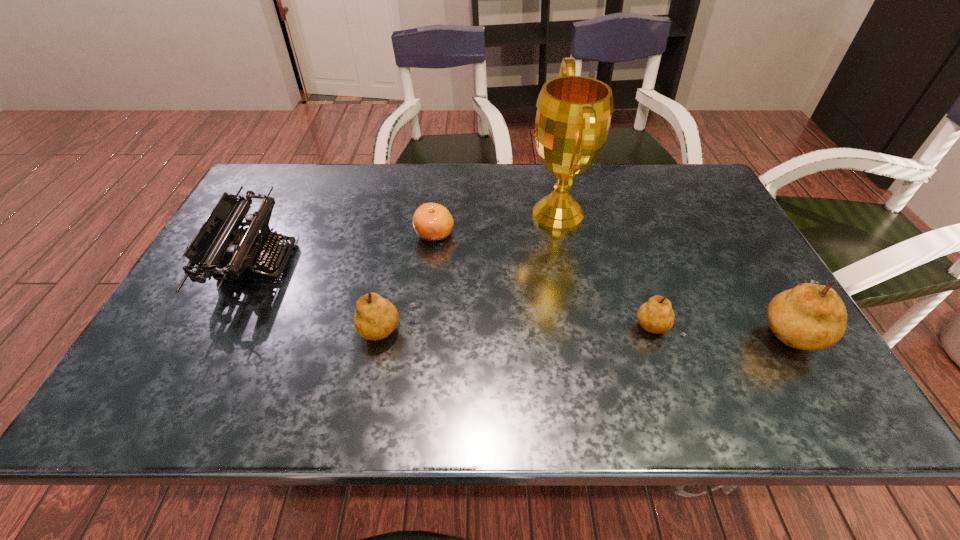
Identify the location of vacant area that lies between the tallest pear and the clementine. [x=612, y=282].

This screenshot has height=540, width=960. In order to click on unoccupied position between the rightmost pear and the leftmost object in this screenshot , I will do (x=522, y=295).

Where is `empty location between the clementine and the fourth object from left to right`? Image resolution: width=960 pixels, height=540 pixels. empty location between the clementine and the fourth object from left to right is located at coordinates (496, 225).

Where is `empty space that is in between the typewriter and the second pear from left to right`? The height and width of the screenshot is (540, 960). empty space that is in between the typewriter and the second pear from left to right is located at coordinates (456, 296).

This screenshot has height=540, width=960. I want to click on free area in between the leftmost object and the second tallest pear, so click(323, 296).

You are a GUI agent. You are given a task and a screenshot of the screen. Output one action in this format:
    pyautogui.click(x=<x>, y=<y>)
    Task: Click on the unoccupied area between the leftmost object and the tallest object
    
    Given the screenshot: What is the action you would take?
    pyautogui.click(x=407, y=238)

This screenshot has width=960, height=540. Identify the location of free space between the clementine and the rightmost object. (612, 282).

In order to click on empty space between the second tallest object and the typewriter in this screenshot , I will do `click(522, 295)`.

Select which object appears as the fourth closest to the typewriter. Please provide its 2D coordinates. Your answer should be formatted as a tuple, i.e. [(x, y)], where the tuple contains the x and y coordinates of a point satisfying the conditions above.

[(655, 316)]

Locate an element on the screen. Image resolution: width=960 pixels, height=540 pixels. object identified as the fifth closest to the fifth shortest object is located at coordinates (220, 249).